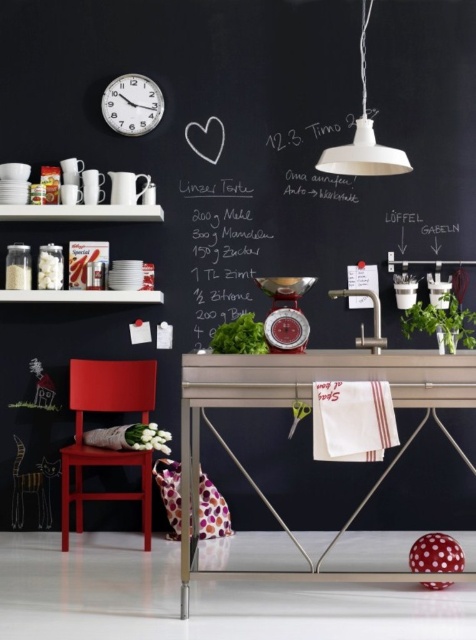
Which is in front, point (122, 387) or point (468, 346)?

Point (468, 346)

Can you confirm if matte red chair at left is thinner than green matte plant at right?

Yes, matte red chair at left is thinner than green matte plant at right.

Who is more distant from viewer, (88, 452) or (409, 310)?

Positioned behind is point (88, 452).

Image resolution: width=476 pixels, height=640 pixels. In order to click on matte red chair at left in this screenshot , I will do `click(103, 449)`.

Can you confirm if white metallic clock at upper left is positioned to the right of green matte plant at right?

Incorrect, white metallic clock at upper left is not on the right side of green matte plant at right.

Between white metallic clock at upper left and green matte plant at right, which one appears on the left side from the viewer's perspective?

Positioned to the left is white metallic clock at upper left.

Measure the distance between white metallic clock at upper left and camera.

4.02 meters

You are a GUI agent. You are given a task and a screenshot of the screen. Output one action in this format:
    pyautogui.click(x=<x>, y=<y>)
    Task: Click on the white metallic clock at upper left
    The image size is (476, 640).
    Given the screenshot: What is the action you would take?
    pyautogui.click(x=131, y=104)

How distant is matte red chair at left from white metallic clock at upper left?

A distance of 5.22 feet exists between matte red chair at left and white metallic clock at upper left.

Locate an element on the screen. matte red chair at left is located at coordinates 103,449.